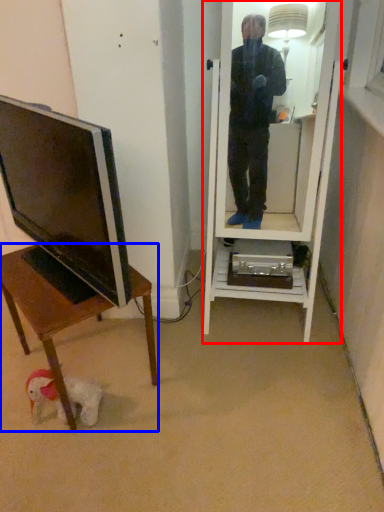
Question: Which of the following is the closest to the observer, mirror (highlighted by a red box) or desk (highlighted by a blue box)?

Choices:
 (A) mirror
 (B) desk

Answer: (A)